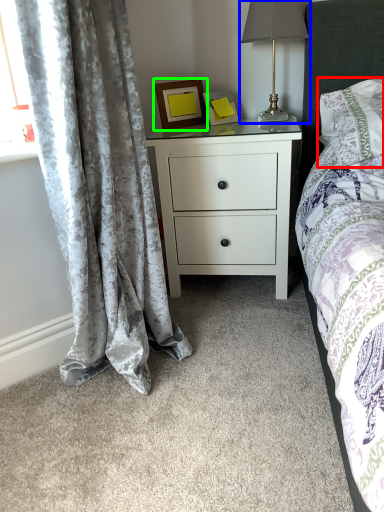
Question: Considering the real-world distances, which object is closest to pillow (highlighted by a red box)? table lamp (highlighted by a blue box) or picture frame (highlighted by a green box).

Choices:
 (A) table lamp
 (B) picture frame

Answer: (A)